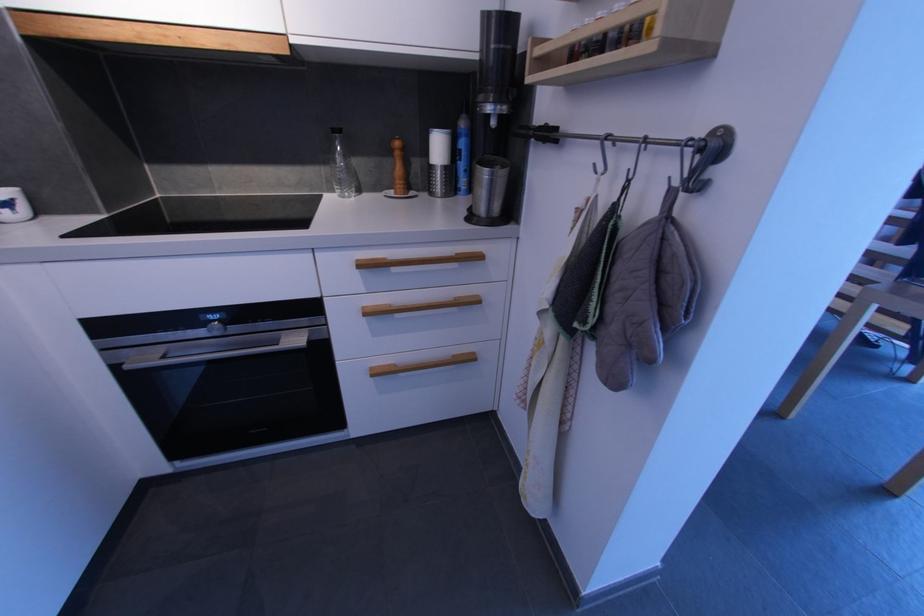
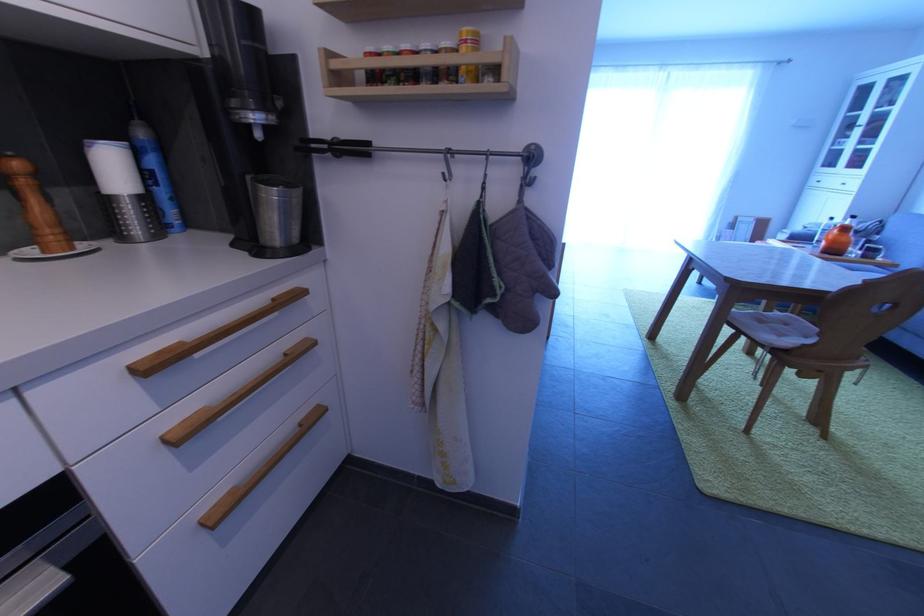
Question: The camera is either moving clockwise (left) or counter-clockwise (right) around the object. The first image is from the beginning of the video and the second image is from the end. Is the camera moving left or right when shooting the video?

Choices:
 (A) Left
 (B) Right

Answer: (A)